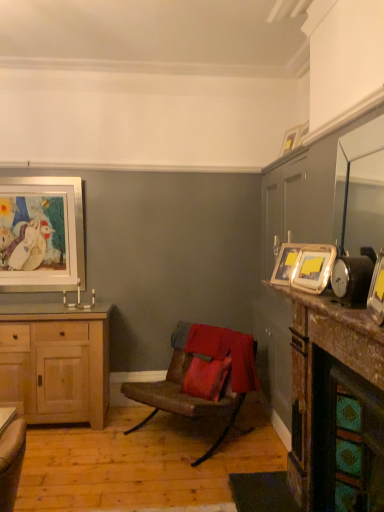
Identify the location of free space above matte white picture frame at upper left, the 1th picture frame when ordered from left to right (from a real-world perspective). (36, 179).